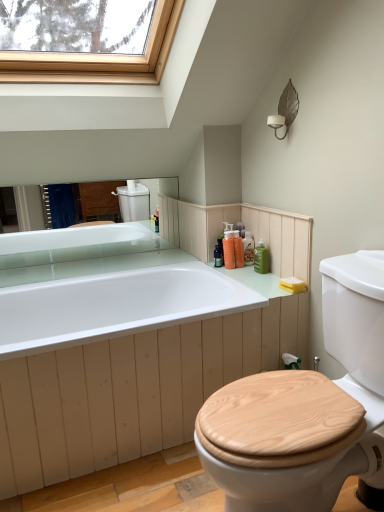
Locate an element on the screen. This screenshot has height=512, width=384. vacant area situated to the left side of translucent plastic bottles at upper right, marked as the 4th toiletry in a right-to-left arrangement is located at coordinates (211, 262).